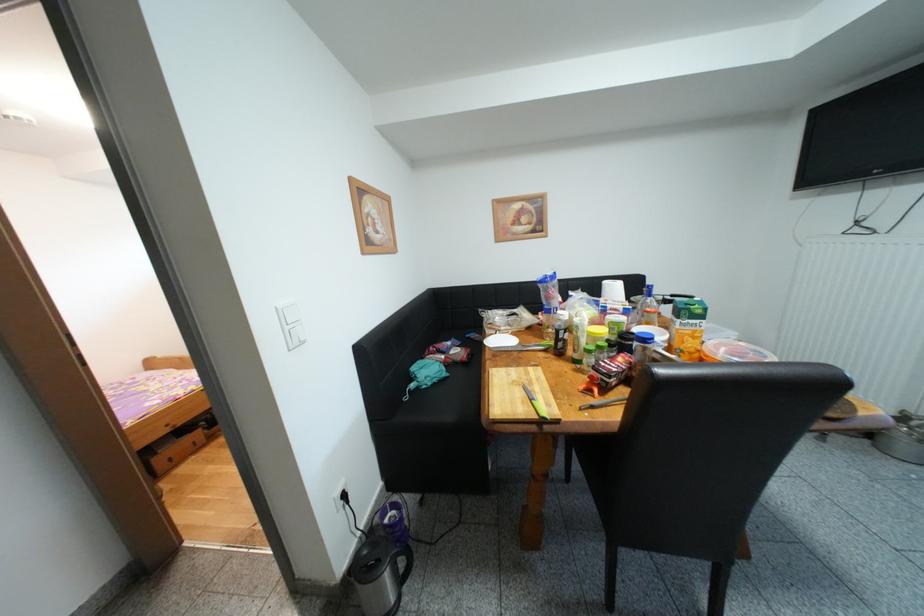
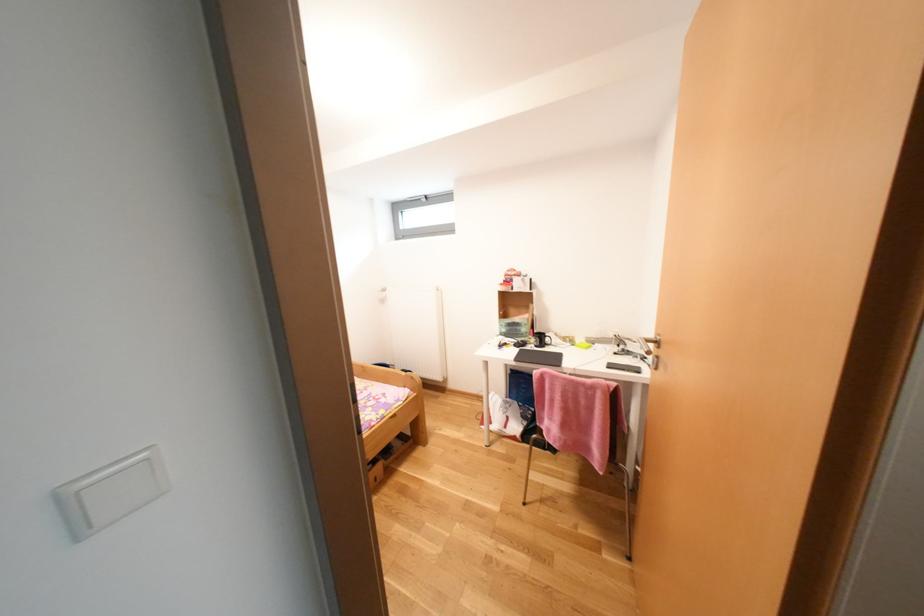
In a continuous first-person perspective shot, in which direction is the camera moving?

The cameraman walked toward left, forward.